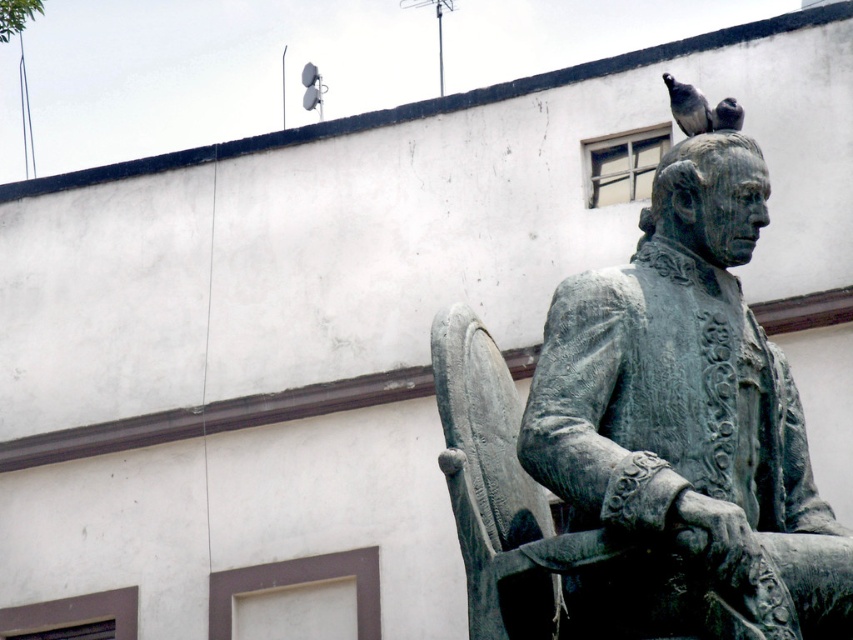
From the picture: Who is taller, dark gray feathers at upper center or gray matte bird at upper right?

With more height is dark gray feathers at upper center.

Does dark gray feathers at upper center come in front of gray matte bird at upper right?

No, it is not.

Where is `dark gray feathers at upper center`? This screenshot has width=853, height=640. dark gray feathers at upper center is located at coordinates (688, 106).

Can you confirm if bronze statue at upper right is positioned below gray matte bird at upper right?

Indeed, bronze statue at upper right is positioned under gray matte bird at upper right.

Who is positioned more to the left, bronze statue at upper right or gray matte bird at upper right?

bronze statue at upper right is more to the left.

Between point (639, 339) and point (729, 113), which one is positioned in front?

Positioned in front is point (639, 339).

Locate an element on the screen. The height and width of the screenshot is (640, 853). bronze statue at upper right is located at coordinates (685, 420).

Does bronze statue at upper right have a greater height compared to dark gray feathers at upper center?

Yes.

Is the position of bronze statue at upper right less distant than that of dark gray feathers at upper center?

That is True.

At what (x,y) coordinates should I click in order to perform the action: click on bronze statue at upper right. Please return your answer as a coordinate pair (x, y). The height and width of the screenshot is (640, 853). Looking at the image, I should click on (685, 420).